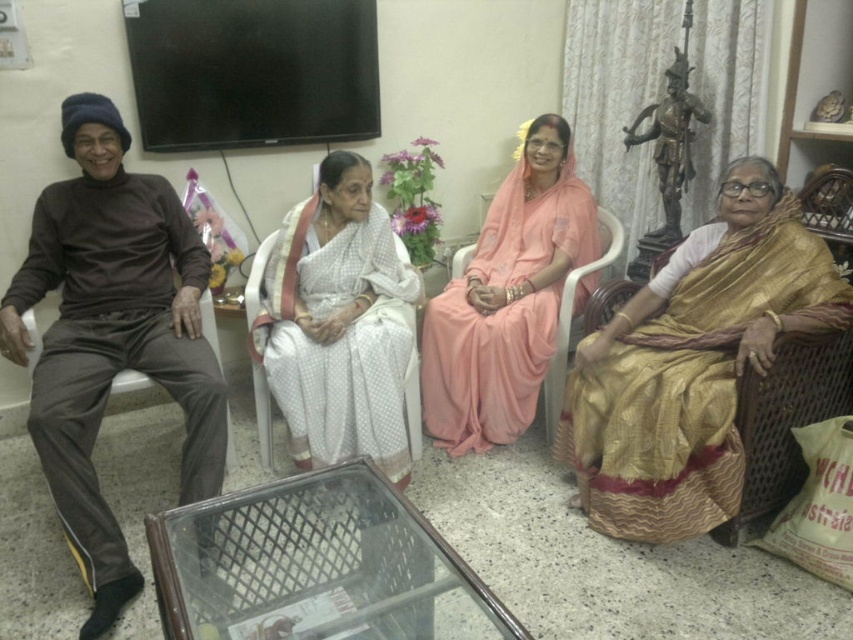
Question: Which object is closer to the camera taking this photo?

Choices:
 (A) white silk saree at center
 (B) gold silk saree at right
 (C) pink silk saree at center
 (D) brown fabric armchair at left

Answer: (B)

Question: Which point is closer to the camera taking this photo?

Choices:
 (A) (271, 272)
 (B) (122, 372)

Answer: (B)

Question: Is white silk saree at center thinner than brown fabric armchair at left?

Choices:
 (A) no
 (B) yes

Answer: (A)

Question: Is white silk saree at center bigger than pink silk saree at center?

Choices:
 (A) yes
 (B) no

Answer: (B)

Question: Is gold silk saree at right wider than white silk saree at center?

Choices:
 (A) no
 (B) yes

Answer: (B)

Question: Which object is positioned closest to the brown fabric armchair at left?

Choices:
 (A) white silk saree at center
 (B) pink silk saree at center
 (C) gold silk saree at right

Answer: (A)